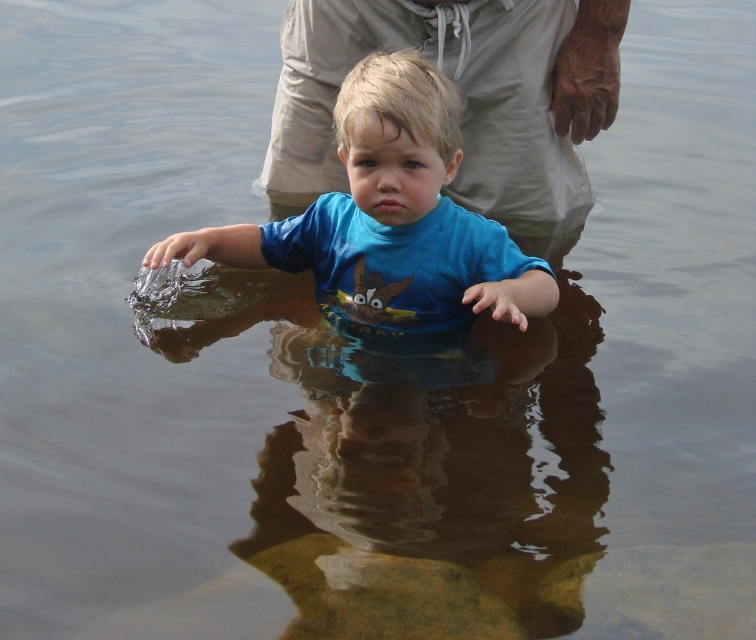
Question: Does beige cotton pants at upper center appear over blue matte shirt at center?

Choices:
 (A) no
 (B) yes

Answer: (B)

Question: Among these objects, which one is farthest from the camera?

Choices:
 (A) beige cotton pants at upper center
 (B) blue matte shirt at center

Answer: (A)

Question: Which point is closer to the camera?

Choices:
 (A) (459, 262)
 (B) (299, 67)

Answer: (A)

Question: Is beige cotton pants at upper center closer to camera compared to blue matte shirt at center?

Choices:
 (A) yes
 (B) no

Answer: (B)

Question: Is beige cotton pants at upper center above blue matte shirt at center?

Choices:
 (A) no
 (B) yes

Answer: (B)